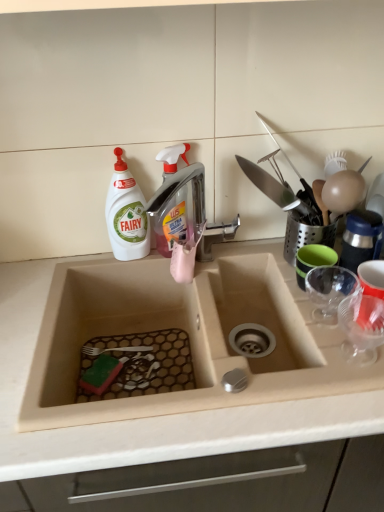
Question: Is transparent plastic cup at right, the 2th tableware positioned from the back, in front of or behind metallic silver faucet at upper center in the image?

Choices:
 (A) front
 (B) behind

Answer: (A)

Question: Considering the positions of transparent plastic cup at right, placed as the 2th tableware when sorted from front to back, and metallic silver faucet at upper center in the image, is transparent plastic cup at right, placed as the 2th tableware when sorted from front to back, taller or shorter than metallic silver faucet at upper center?

Choices:
 (A) short
 (B) tall

Answer: (A)

Question: Which object is the closest to the white matte bottle at upper left, marked as the second cleaning product in a right-to-left arrangement?

Choices:
 (A) transparent plastic cup at right, which ranks as the third tableware in back-to-front order
 (B) translucent plastic spray bottle at center, which is the 2th cleaning product in left-to-right order
 (C) green rubber cup at right, positioned as the 3th tableware in front-to-back order
 (D) beige matte sink at center
 (E) transparent plastic cup at right, placed as the 2th tableware when sorted from front to back

Answer: (B)

Question: Estimate the real-world distances between objects in this image. Which object is farther from the transparent plastic cup at right, placed as the 2th tableware when sorted from front to back?

Choices:
 (A) metallic silver faucet at upper center
 (B) green rubber cup at right, which appears as the first tableware when viewed from the back
 (C) transparent plastic cup at right, which ranks as the third tableware in back-to-front order
 (D) translucent plastic spray bottle at center, which is the 2th cleaning product in left-to-right order
 (E) beige matte sink at center

Answer: (E)